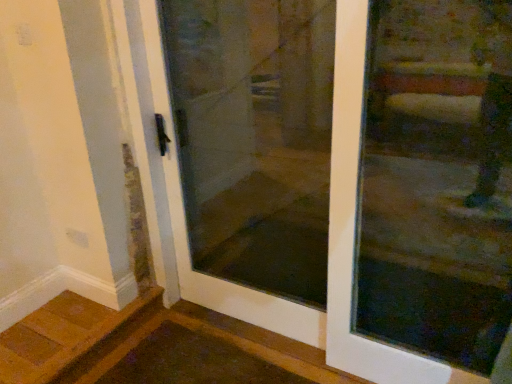
Question: Is transparent glass door at center bigger or smaller than transparent glass door at center?

Choices:
 (A) big
 (B) small

Answer: (A)

Question: In terms of width, does transparent glass door at center look wider or thinner when compared to transparent glass door at center?

Choices:
 (A) wide
 (B) thin

Answer: (A)

Question: Would you say transparent glass door at center is inside or outside transparent glass door at center?

Choices:
 (A) inside
 (B) outside

Answer: (B)

Question: From the image's perspective, is transparent glass door at center located above or below transparent glass door at center?

Choices:
 (A) below
 (B) above

Answer: (A)

Question: Looking at their shapes, would you say transparent glass door at center is wider or thinner than transparent glass door at center?

Choices:
 (A) wide
 (B) thin

Answer: (B)

Question: Considering their positions, is transparent glass door at center located in front of or behind transparent glass door at center?

Choices:
 (A) front
 (B) behind

Answer: (A)

Question: Considering the positions of transparent glass door at center and transparent glass door at center in the image, is transparent glass door at center bigger or smaller than transparent glass door at center?

Choices:
 (A) small
 (B) big

Answer: (A)